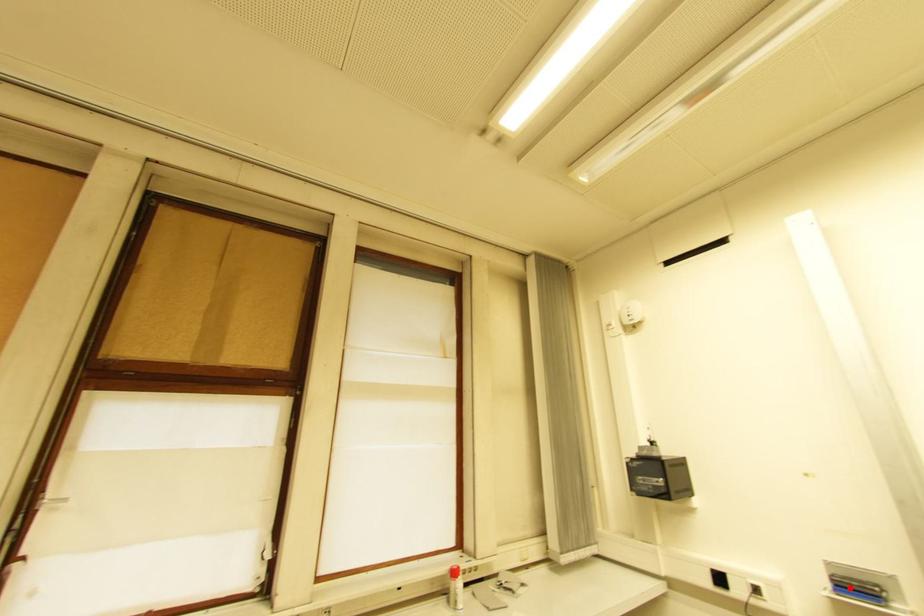
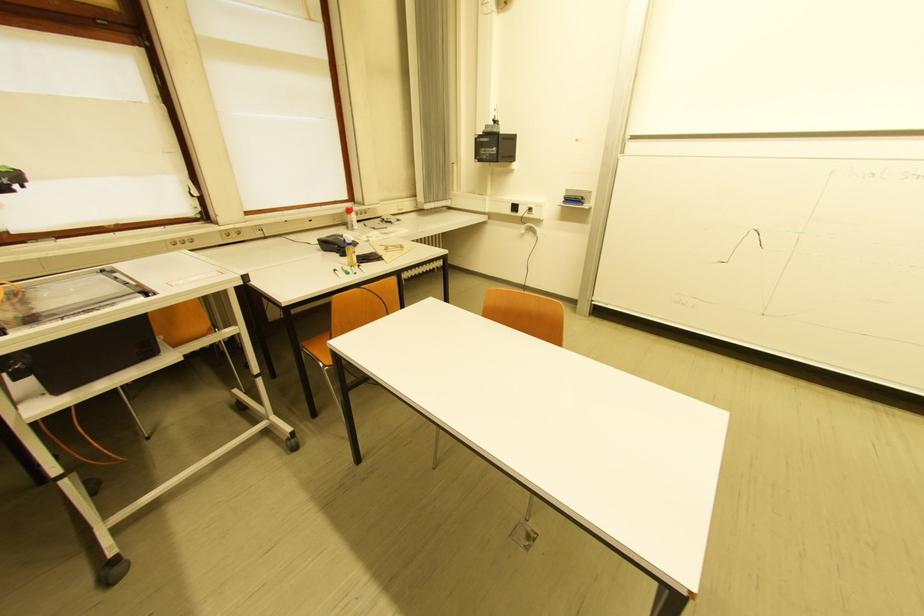
Question: I am providing you with two images of the same scene from different viewpoints. A red point is shown in image1. For the corresponding object point in image2, is it positioned nearer or farther from the camera?

Choices:
 (A) Nearer
 (B) Farther

Answer: (B)